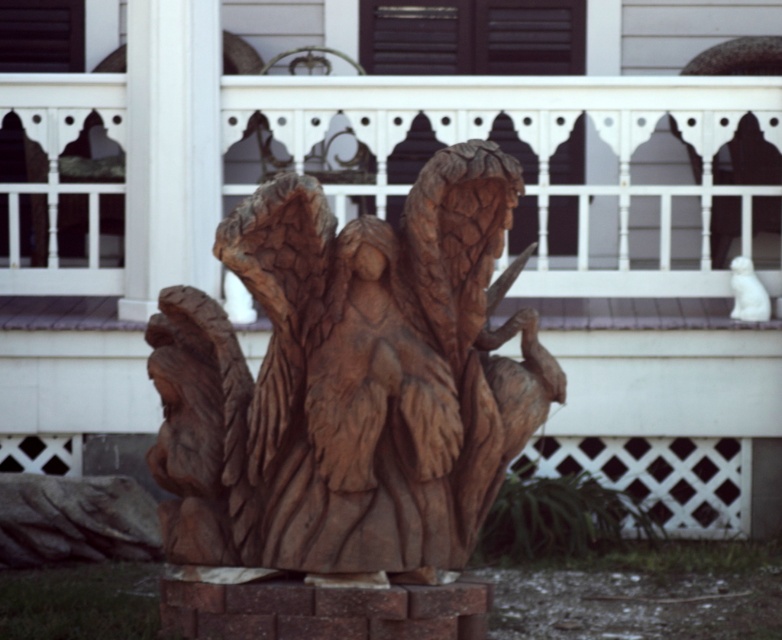
Is white wood railing at center further to the viewer compared to brown wood carving at center?

That is True.

The image size is (782, 640). I want to click on white wood railing at center, so click(596, 266).